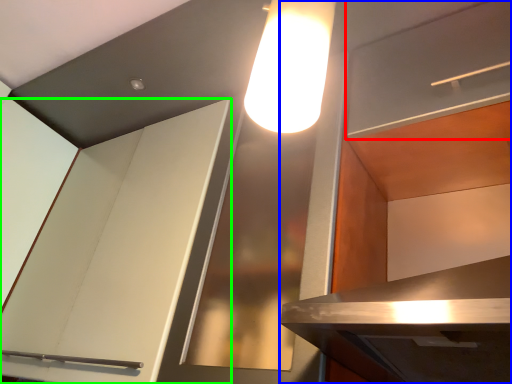
Question: Considering the real-world distances, which object is farthest from shelf (highlighted by a red box)? cabinetry (highlighted by a blue box) or cabinetry (highlighted by a green box)?

Choices:
 (A) cabinetry
 (B) cabinetry

Answer: (B)